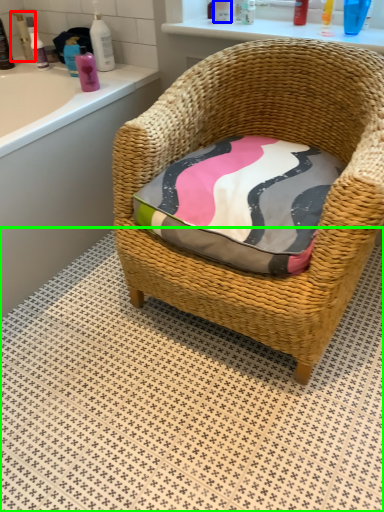
Question: Based on their relative distances, which object is farther from toiletry (highlighted by a red box)? Choose from toiletry (highlighted by a blue box) and tile (highlighted by a green box).

Choices:
 (A) toiletry
 (B) tile

Answer: (B)